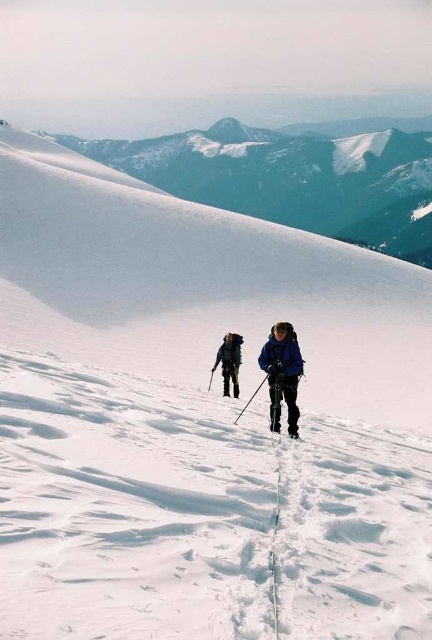
Who is taller, dark blue jacket at center or black matte ski at center?

Standing taller between the two is dark blue jacket at center.

The height and width of the screenshot is (640, 432). I want to click on dark blue jacket at center, so click(x=228, y=362).

Which is more to the left, blue fabric jacket at center or black matte ski at center?

From the viewer's perspective, blue fabric jacket at center appears more on the left side.

Who is more distant from viewer, [292,384] or [294,432]?

Point [294,432]

This screenshot has height=640, width=432. I want to click on blue fabric jacket at center, so click(x=282, y=372).

Who is positioned more to the right, blue fabric jacket at center or dark blue jacket at center?

Positioned to the right is blue fabric jacket at center.

Is blue fabric jacket at center further to the viewer compared to dark blue jacket at center?

No, it is not.

Is point (282, 352) positioned in front of point (222, 372)?

Yes.

At what (x,y) coordinates should I click in order to perform the action: click on blue fabric jacket at center. Please return your answer as a coordinate pair (x, y). The width and height of the screenshot is (432, 640). Looking at the image, I should click on (282, 372).